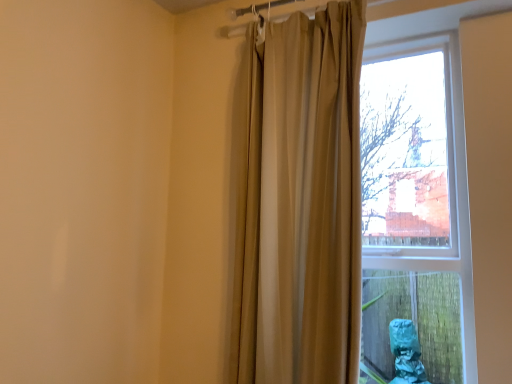
At what (x,y) coordinates should I click in order to perform the action: click on beige fabric curtain at center. Please return your answer as a coordinate pair (x, y). Image resolution: width=512 pixels, height=384 pixels. Looking at the image, I should click on (301, 202).

What do you see at coordinates (301, 202) in the screenshot? The height and width of the screenshot is (384, 512). I see `beige fabric curtain at center` at bounding box center [301, 202].

I want to click on matte glass window at center, so click(x=434, y=183).

The image size is (512, 384). Describe the element at coordinates (434, 183) in the screenshot. I see `matte glass window at center` at that location.

In order to click on beige fabric curtain at center in this screenshot , I will do `click(301, 202)`.

Considering the relative positions of beige fabric curtain at center and matte glass window at center in the image provided, is beige fabric curtain at center to the left or to the right of matte glass window at center?

Clearly, beige fabric curtain at center is on the left of matte glass window at center in the image.

Which object is closer to the camera, beige fabric curtain at center or matte glass window at center?

matte glass window at center.

Between point (297, 233) and point (493, 17), which one is positioned in front?

The point (297, 233) is more forward.

From the image's perspective, would you say beige fabric curtain at center is shown under matte glass window at center?

No.

From a real-world perspective, who is located lower, beige fabric curtain at center or matte glass window at center?

matte glass window at center.

Is beige fabric curtain at center wider or thinner than matte glass window at center?

In the image, beige fabric curtain at center appears to be more narrow than matte glass window at center.

Does beige fabric curtain at center have a lesser height compared to matte glass window at center?

Incorrect, the height of beige fabric curtain at center does not fall short of that of matte glass window at center.

Who is bigger, beige fabric curtain at center or matte glass window at center?

matte glass window at center is bigger.

Which is correct: beige fabric curtain at center is inside matte glass window at center, or outside of it?

Result: beige fabric curtain at center exists outside the volume of matte glass window at center.

Is beige fabric curtain at center directly adjacent to matte glass window at center?

No, beige fabric curtain at center is not beside matte glass window at center.

Is beige fabric curtain at center positioned with its back to matte glass window at center?

Yes, beige fabric curtain at center's orientation is away from matte glass window at center.

How different are the orientations of beige fabric curtain at center and matte glass window at center in degrees?

0.000909 degrees.

This screenshot has width=512, height=384. What are the coordinates of `curtain above the matte glass window at center (from a real-world perspective)` in the screenshot? It's located at (301, 202).

Between matte glass window at center and beige fabric curtain at center, which one appears on the left side from the viewer's perspective?

From the viewer's perspective, beige fabric curtain at center appears more on the left side.

Considering the relative positions of matte glass window at center and beige fabric curtain at center in the image provided, is matte glass window at center in front of beige fabric curtain at center?

Yes.

Considering the positions of point (401, 199) and point (264, 111), is point (401, 199) closer or farther from the camera than point (264, 111)?

Point (401, 199) is farther from the camera than point (264, 111).

From the image's perspective, is matte glass window at center on top of beige fabric curtain at center?

No, from the image's perspective, matte glass window at center is not above beige fabric curtain at center.

From a real-world perspective, is matte glass window at center positioned above or below beige fabric curtain at center?

Clearly, from a real-world perspective, matte glass window at center is below beige fabric curtain at center.

Consider the image. Does matte glass window at center have a lesser width compared to beige fabric curtain at center?

No, matte glass window at center is not thinner than beige fabric curtain at center.

Who is shorter, matte glass window at center or beige fabric curtain at center?

Standing shorter between the two is matte glass window at center.

Considering the sizes of matte glass window at center and beige fabric curtain at center in the image, is matte glass window at center bigger or smaller than beige fabric curtain at center?

matte glass window at center is bigger than beige fabric curtain at center.

Is matte glass window at center inside or outside of beige fabric curtain at center?

matte glass window at center is not enclosed by beige fabric curtain at center.

Is matte glass window at center positioned far away from beige fabric curtain at center?

Yes.

Based on the photo, could you tell me if matte glass window at center is facing beige fabric curtain at center?

Yes, matte glass window at center is oriented towards beige fabric curtain at center.

What's the angular difference between matte glass window at center and beige fabric curtain at center's facing directions?

The facing directions of matte glass window at center and beige fabric curtain at center are 0.000909 degrees apart.

Measure the distance from matte glass window at center to beige fabric curtain at center.

The distance of matte glass window at center from beige fabric curtain at center is 3.33 meters.

The height and width of the screenshot is (384, 512). In the image, there is a matte glass window at center. Find the location of `curtain above it (from the image's perspective)`. curtain above it (from the image's perspective) is located at coordinates (301, 202).

At what (x,y) coordinates should I click in order to perform the action: click on curtain behind the matte glass window at center. Please return your answer as a coordinate pair (x, y). The image size is (512, 384). Looking at the image, I should click on (301, 202).

The height and width of the screenshot is (384, 512). Find the location of `window that appears below the beige fabric curtain at center (from a real-world perspective)`. window that appears below the beige fabric curtain at center (from a real-world perspective) is located at coordinates (434, 183).